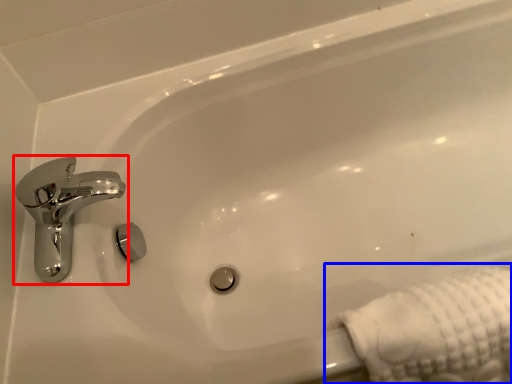
Question: Which object is closer to the camera taking this photo, tap (highlighted by a red box) or bath towel (highlighted by a blue box)?

Choices:
 (A) tap
 (B) bath towel

Answer: (B)